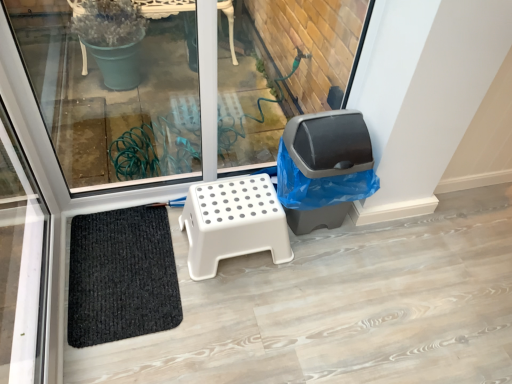
Where is `free space that is in between white plastic stool at center and black woven mat at lower left`? free space that is in between white plastic stool at center and black woven mat at lower left is located at coordinates (212, 280).